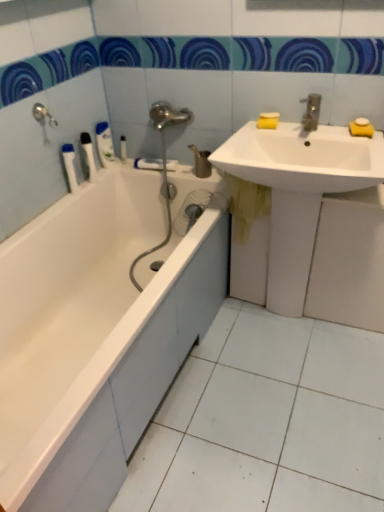
Question: Is white plastic tube at upper left, which is counted as the fourth toiletry, starting from the left, positioned behind white glossy bathtub at left?

Choices:
 (A) yes
 (B) no

Answer: (A)

Question: From a real-world perspective, is white plastic tube at upper left, which is counted as the fourth toiletry, starting from the left, on white glossy bathtub at left?

Choices:
 (A) no
 (B) yes

Answer: (B)

Question: From the image's perspective, does white plastic tube at upper left, which is the first toiletry in right-to-left order, appear lower than white glossy bathtub at left?

Choices:
 (A) no
 (B) yes

Answer: (A)

Question: From the image's perspective, is white plastic tube at upper left, which is counted as the fourth toiletry, starting from the left, on top of white glossy bathtub at left?

Choices:
 (A) yes
 (B) no

Answer: (A)

Question: Does white plastic tube at upper left, which is counted as the fourth toiletry, starting from the left, come in front of white glossy bathtub at left?

Choices:
 (A) yes
 (B) no

Answer: (B)

Question: From a real-world perspective, relative to white glossy sink at upper right, positioned as the 2th sink in bottom-to-top order, is white plastic tube at upper left, which is counted as the fourth toiletry, starting from the left, vertically above or below?

Choices:
 (A) above
 (B) below

Answer: (B)

Question: Considering the positions of white plastic tube at upper left, which is counted as the fourth toiletry, starting from the left, and white glossy sink at upper right, positioned as the 2th sink in bottom-to-top order, in the image, is white plastic tube at upper left, which is counted as the fourth toiletry, starting from the left, taller or shorter than white glossy sink at upper right, positioned as the 2th sink in bottom-to-top order,?

Choices:
 (A) short
 (B) tall

Answer: (A)

Question: Considering the positions of point (124, 136) and point (210, 161), is point (124, 136) closer or farther from the camera than point (210, 161)?

Choices:
 (A) closer
 (B) farther

Answer: (B)

Question: Would you say white plastic tube at upper left, which is counted as the fourth toiletry, starting from the left, is to the left or to the right of white glossy sink at upper right, which is the first sink in top-to-bottom order, in the picture?

Choices:
 (A) right
 (B) left

Answer: (B)

Question: Would you say white plastic toilet brush at upper left, the second toiletry from the right, is to the left or to the right of white glossy sink at lower right, arranged as the second sink when viewed from the top, in the picture?

Choices:
 (A) left
 (B) right

Answer: (A)

Question: Is point (102, 154) positioned closer to the camera than point (382, 142)?

Choices:
 (A) closer
 (B) farther

Answer: (B)

Question: Would you say white plastic toilet brush at upper left, positioned as the 3th toiletry in left-to-right order, is inside or outside white glossy sink at lower right, the 1th sink when ordered from bottom to top?

Choices:
 (A) outside
 (B) inside

Answer: (A)

Question: From a real-world perspective, is white plastic toilet brush at upper left, positioned as the 3th toiletry in left-to-right order, physically located above or below white glossy sink at lower right, the 1th sink when ordered from bottom to top?

Choices:
 (A) above
 (B) below

Answer: (A)

Question: From a real-world perspective, is white glossy sink at upper right, which is the first sink in top-to-bottom order, physically located above or below white plastic toothbrush at left, which ranks as the 2th toiletry in left-to-right order?

Choices:
 (A) above
 (B) below

Answer: (A)

Question: From the image's perspective, is white glossy sink at upper right, which is the first sink in top-to-bottom order, located above or below white plastic toothbrush at left, which ranks as the 2th toiletry in left-to-right order?

Choices:
 (A) below
 (B) above

Answer: (A)